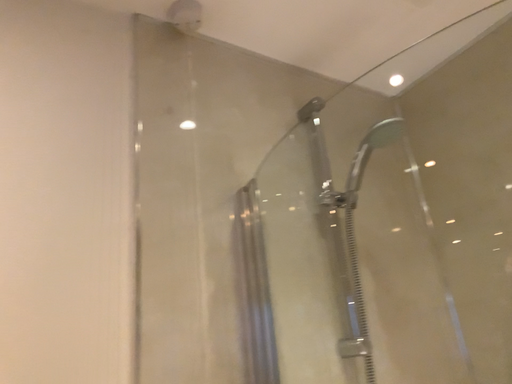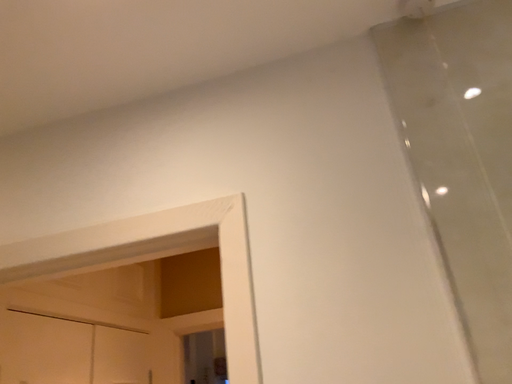
Question: How did the camera likely rotate when shooting the video?

Choices:
 (A) rotated right
 (B) rotated left

Answer: (B)